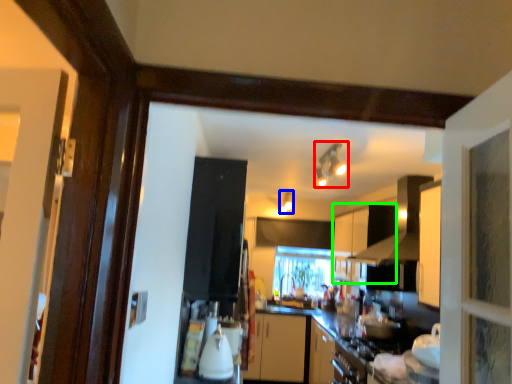
Question: Based on their relative distances, which object is nearer to light fixture (highlighted by a red box)? Choose from light fixture (highlighted by a blue box) and cabinetry (highlighted by a green box).

Choices:
 (A) light fixture
 (B) cabinetry

Answer: (B)